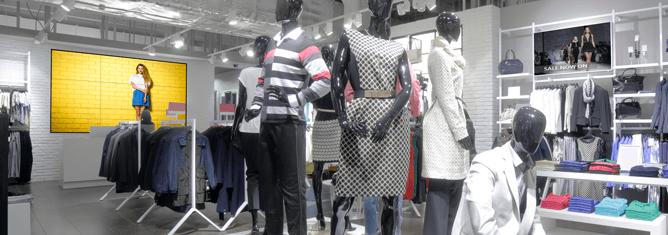
Image resolution: width=668 pixels, height=235 pixels. What are the coordinates of `mannequins` in the screenshot? It's located at (449, 111), (387, 80), (244, 86), (268, 90), (510, 195).